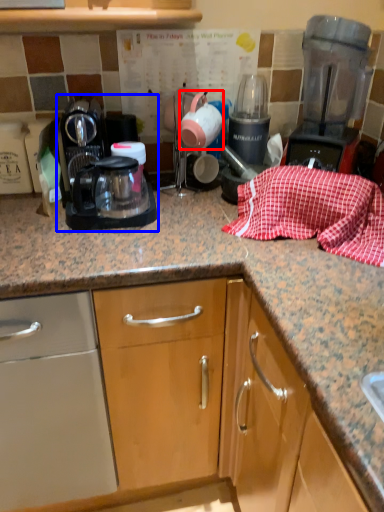
Question: Among these objects, which one is farthest to the camera, tea pot (highlighted by a red box) or kitchen appliance (highlighted by a blue box)?

Choices:
 (A) tea pot
 (B) kitchen appliance

Answer: (A)